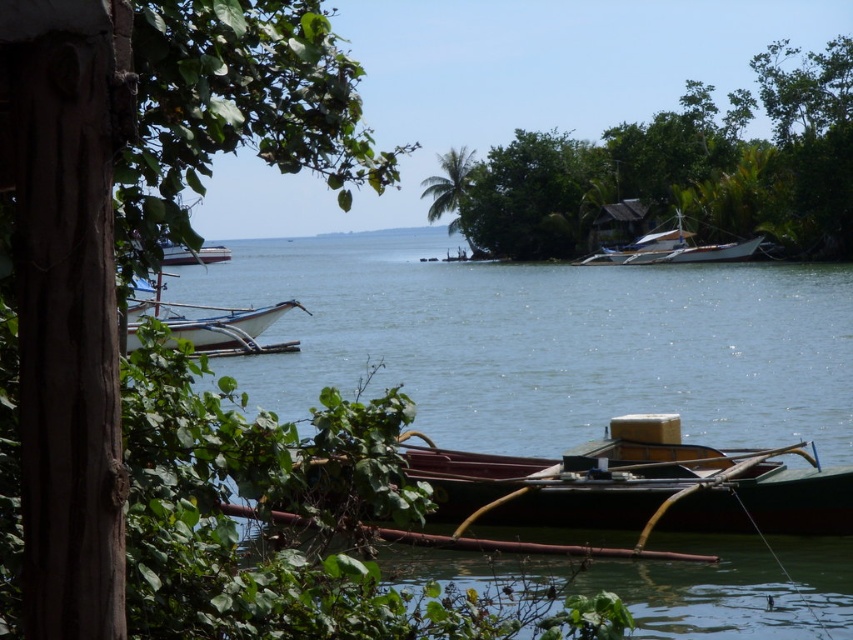
Question: Which of the following is the closest to the observer?

Choices:
 (A) (142, 316)
 (B) (679, 259)
 (C) (548, 228)
 (D) (813, 225)

Answer: (A)

Question: Estimate the real-world distances between objects in this image. Which object is farther from the white glossy boat at center?

Choices:
 (A) wooden boat at center
 (B) green leafy tree at center

Answer: (B)

Question: Can you confirm if white wooden boat at left is thinner than green leafy palm tree at center?

Choices:
 (A) yes
 (B) no

Answer: (B)

Question: Can you confirm if wooden boat at center is wider than green leafy tree at center?

Choices:
 (A) yes
 (B) no

Answer: (B)

Question: Considering the real-world distances, which object is closest to the green leafy tree at upper left?

Choices:
 (A) green leafy palm tree at center
 (B) white wooden boat at center
 (C) white wooden boat at left

Answer: (A)

Question: Where is green leafy tree at center located in relation to white wooden boat at left in the image?

Choices:
 (A) above
 (B) below

Answer: (A)